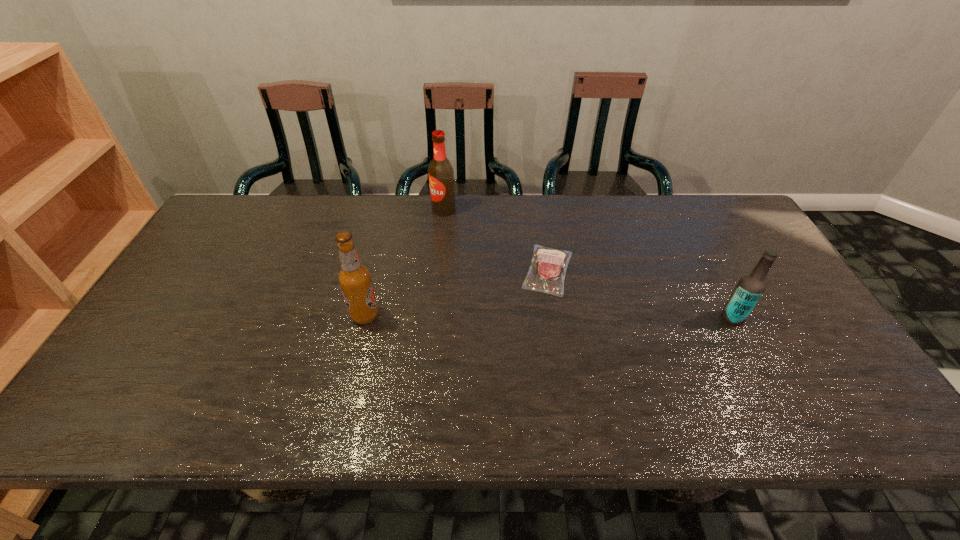
Locate an element on the screen. The height and width of the screenshot is (540, 960). vacant position located on the label of the rightmost beer bottle is located at coordinates (687, 318).

At what (x,y) coordinates should I click in order to perform the action: click on vacant space located 0.220m on the label of the rightmost beer bottle. Please return your answer as a coordinate pair (x, y). Looking at the image, I should click on (637, 318).

Find the location of `vacant space located 0.140m on the back of the third object from left to right`. vacant space located 0.140m on the back of the third object from left to right is located at coordinates (540, 217).

The height and width of the screenshot is (540, 960). Identify the location of object that is at the far edge. (440, 171).

In the image, there is a desktop. Where is `vacant space at the far edge`? vacant space at the far edge is located at coordinates (584, 195).

The image size is (960, 540). I want to click on vacant area at the near edge, so click(676, 433).

Find the location of `free space at the left edge of the desktop`. free space at the left edge of the desktop is located at coordinates (200, 316).

In order to click on vacant region at the right edge of the desktop in this screenshot , I will do `click(730, 280)`.

Where is `free space at the far left corner`? free space at the far left corner is located at coordinates tap(263, 202).

At what (x,y) coordinates should I click in order to perform the action: click on vacant space at the far right corner. Please return your answer as a coordinate pair (x, y). The height and width of the screenshot is (540, 960). Looking at the image, I should click on (732, 222).